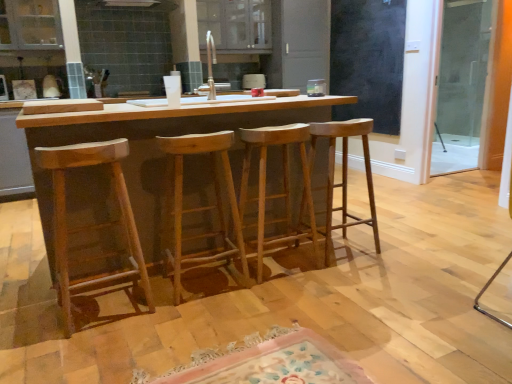
Identify the location of free spot in front of natural wood stool at left, the 4th stool when ordered from right to left. The image size is (512, 384). (80, 350).